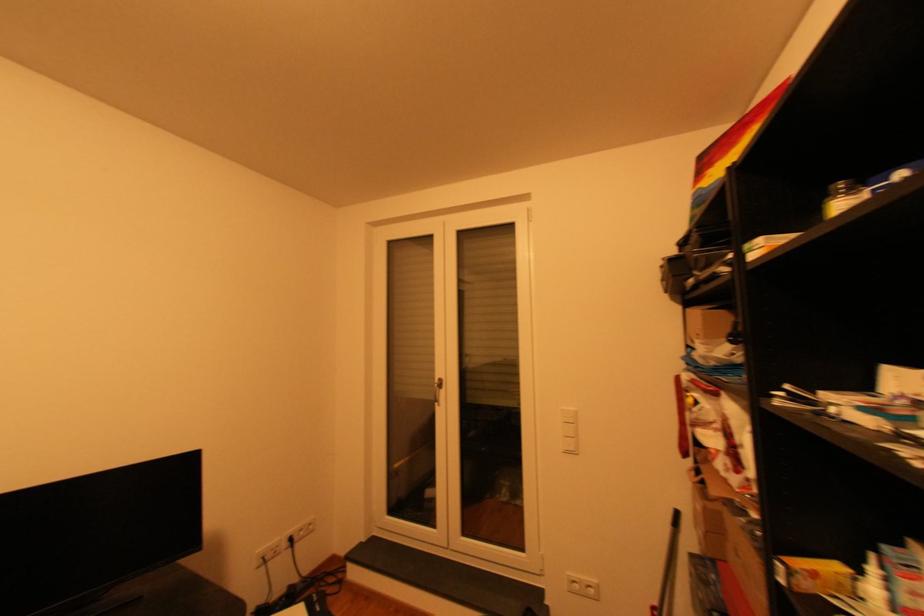
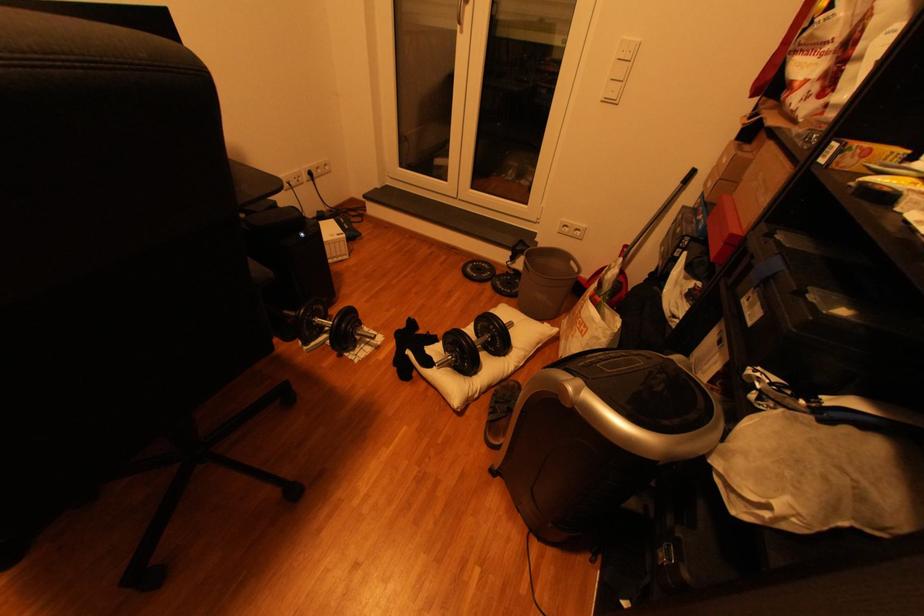
Question: The first image is from the beginning of the video and the second image is from the end. How did the camera likely rotate when shooting the video?

Choices:
 (A) Left
 (B) Right
 (C) Up
 (D) Down

Answer: (D)